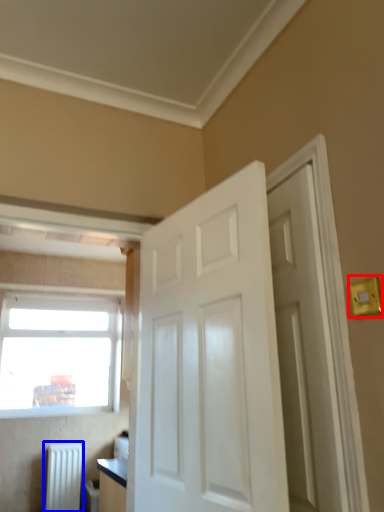
Question: Which point is further to the camera, light switch (highlighted by a red box) or radiator (highlighted by a blue box)?

Choices:
 (A) light switch
 (B) radiator

Answer: (B)